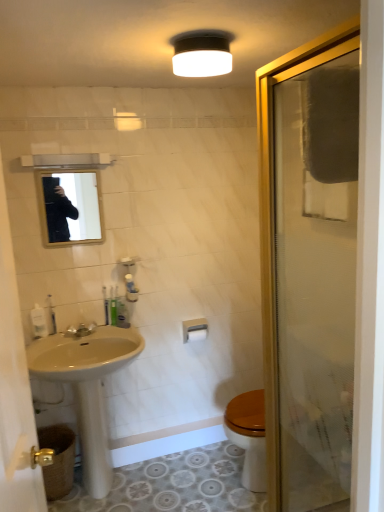
You are a GUI agent. You are given a task and a screenshot of the screen. Output one action in this format:
    pyautogui.click(x=<x>, y=<y>)
    Task: Click on the vacant space to the right of translucent plastic toothbrush at lower left, the second toiletry positioned from the right
    The height and width of the screenshot is (512, 384).
    Given the screenshot: What is the action you would take?
    pyautogui.click(x=77, y=335)